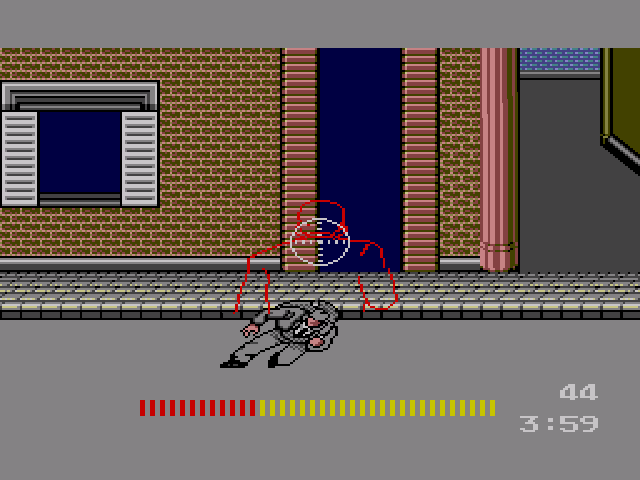
You are a GUI agent. You are given a task and a screenshot of the screen. Output one action in this format:
    pyautogui.click(x=<x>, y=<y>)
    Task: Click on the wall
    
    Given the screenshot: What is the action you would take?
    pyautogui.click(x=476, y=201)